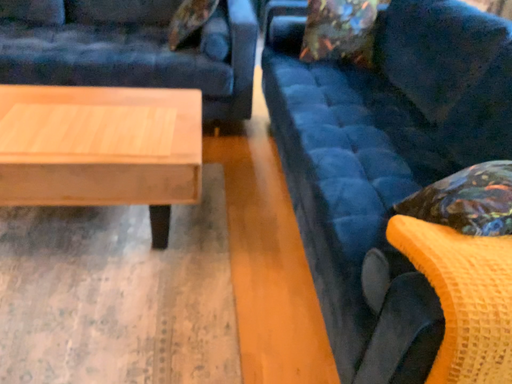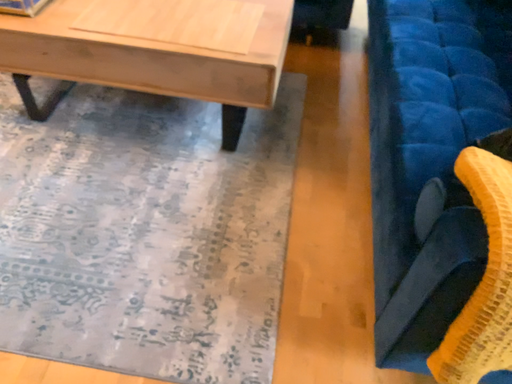
Question: Which way did the camera rotate in the video?

Choices:
 (A) rotated right
 (B) rotated left

Answer: (B)